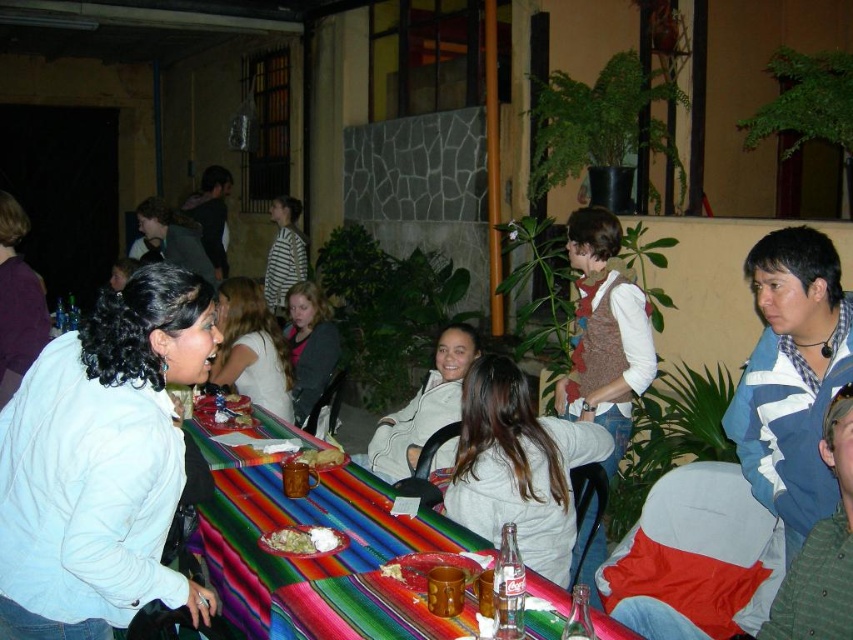
You are a guest at the gathering and want to place your napkin on the multicolored woven tablecloth at center. To do this, should you move your hand to the right or left of the smooth brown bread at center?

The multicolored woven tablecloth at center is to the right of the smooth brown bread at center. Therefore, to place your napkin on the multicolored woven tablecloth at center, you should move your hand to the right of the smooth brown bread at center.

You are standing at the point marked as point [264,435] in the image, which is 3.37 meters away from the camera. If you want to take a photo of the entire table setup, would you need to move closer or farther away?

Since you are already 3.37 meters away from the camera at point [264,435], you might need to move slightly closer to ensure the entire table setup fits in the frame, as the table is likely positioned further back in the scene.